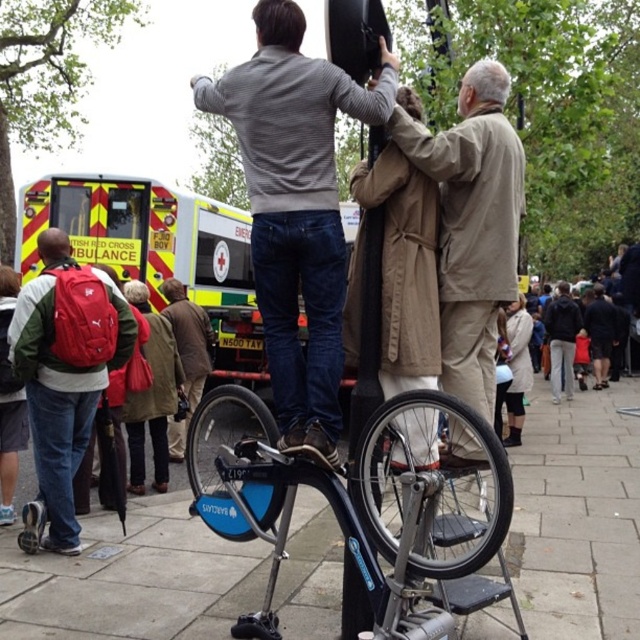
This screenshot has height=640, width=640. I want to click on blue metallic bicycle at center, so click(358, 513).

Which is more to the left, blue metallic bicycle at center or red fabric backpack at lower left?

From the viewer's perspective, red fabric backpack at lower left appears more on the left side.

Who is more forward, (193, 492) or (67, 307)?

Point (193, 492)

Find the location of a particular element. Image resolution: width=640 pixels, height=640 pixels. blue metallic bicycle at center is located at coordinates (358, 513).

Who is more forward, (218, 346) or (61, 368)?

Point (61, 368) is more forward.

Measure the distance between yellow reflective plastic ambulance at upper left and red fabric backpack at lower left.

A distance of 5.98 meters exists between yellow reflective plastic ambulance at upper left and red fabric backpack at lower left.

Image resolution: width=640 pixels, height=640 pixels. I want to click on yellow reflective plastic ambulance at upper left, so click(x=156, y=252).

Who is taller, matte gray sweater at center or blue metallic bicycle at center?

Standing taller between the two is matte gray sweater at center.

How distant is matte gray sweater at center from blue metallic bicycle at center?

matte gray sweater at center is 27.85 inches away from blue metallic bicycle at center.

Who is more distant from viewer, (344, 252) or (358, 483)?

Point (344, 252)

Where is `matte gray sweater at center`? The image size is (640, 640). matte gray sweater at center is located at coordinates (296, 208).